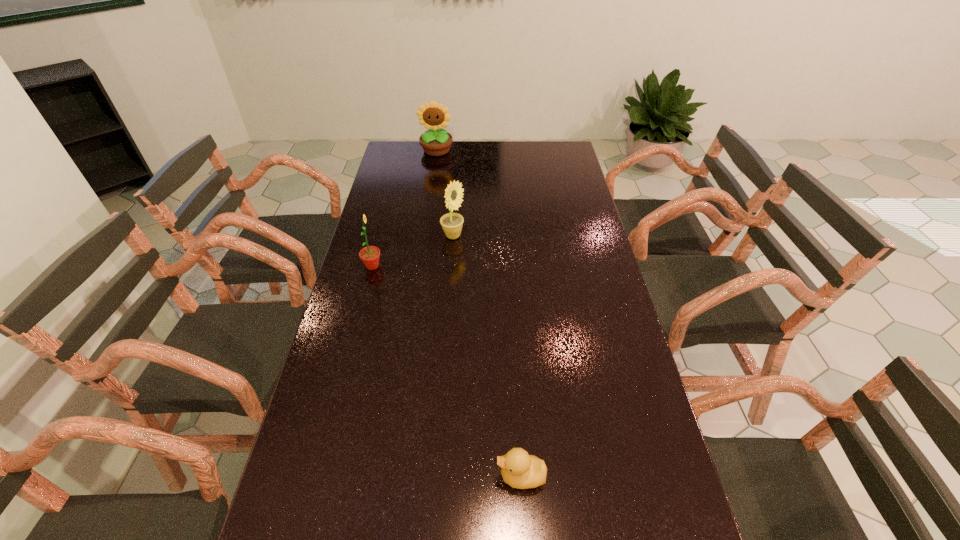
Locate an element on the screen. This screenshot has width=960, height=540. sunflower that is the closest one to the farthest object is located at coordinates (452, 223).

This screenshot has width=960, height=540. Find the location of `sunflower that is the closest to the nearest object`. sunflower that is the closest to the nearest object is located at coordinates (370, 255).

Locate an element on the screen. This screenshot has width=960, height=540. vacant space that satisfies the following two spatial constraints: 1. on the face of the farthest sunflower; 2. on the face of the leftmost sunflower is located at coordinates (420, 266).